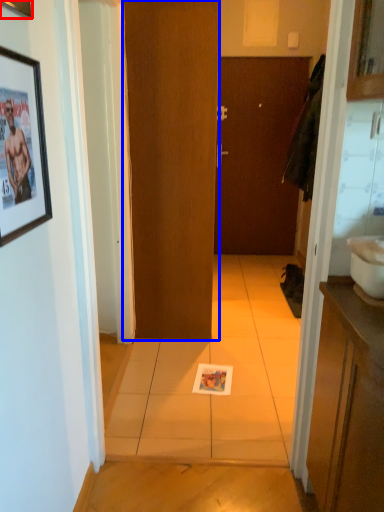
Question: Which object appears farthest to the camera in this image, picture frame (highlighted by a red box) or door (highlighted by a blue box)?

Choices:
 (A) picture frame
 (B) door

Answer: (B)